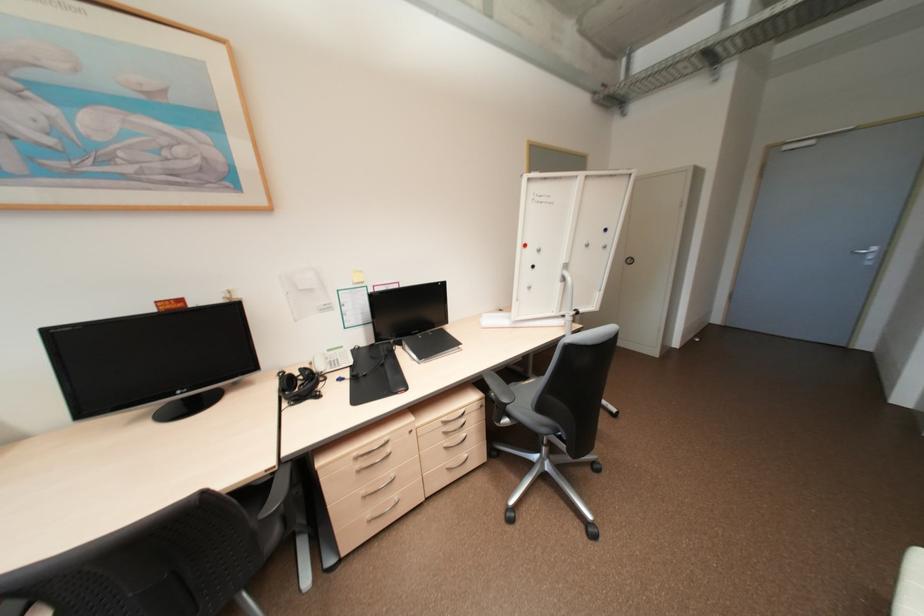
At what (x,y) coordinates should I click in order to perform the action: click on silver door handle. Please return your answer as a coordinate pair (x, y). This screenshot has width=924, height=616. Looking at the image, I should click on (868, 253).